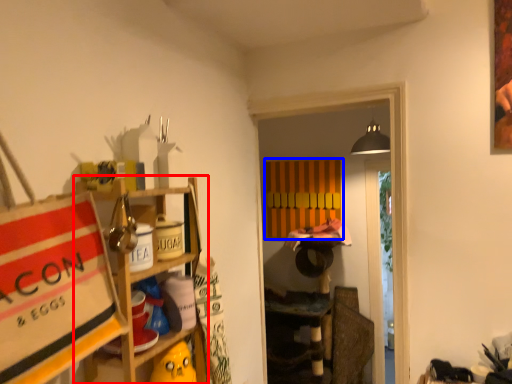
Question: Among these objects, which one is nearest to the camera, shelf (highlighted by a red box) or cabinet (highlighted by a blue box)?

Choices:
 (A) shelf
 (B) cabinet

Answer: (A)